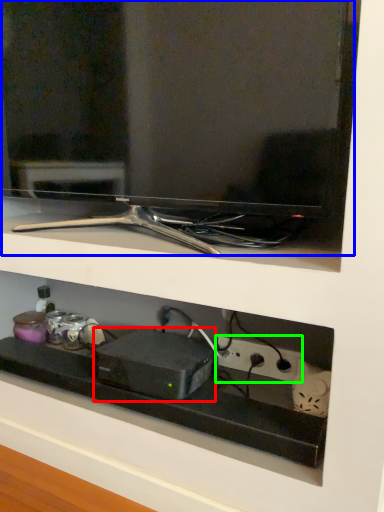
Question: Which is farther away from appliance (highlighted by a red box)? tv show (highlighted by a blue box) or electric outlet (highlighted by a green box)?

Choices:
 (A) tv show
 (B) electric outlet

Answer: (A)